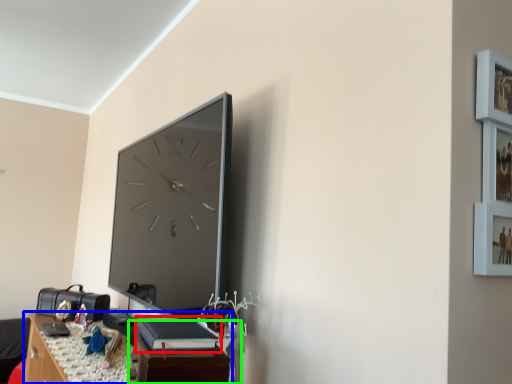
Question: Considering the real-world distances, which object is farthest from book (highlighted by a red box)? table (highlighted by a blue box) or table (highlighted by a green box)?

Choices:
 (A) table
 (B) table

Answer: (A)